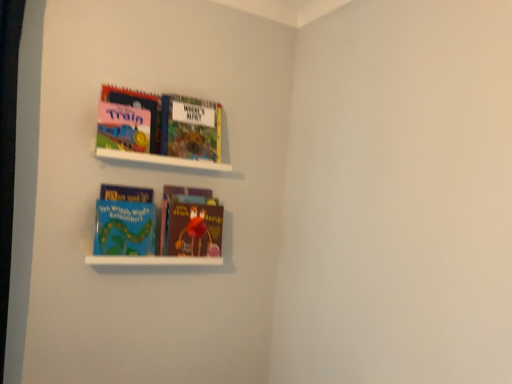
At what (x,y) coordinates should I click in order to perform the action: click on vacant area situated below hardcover book at upper center, the 2th book viewed from the top (from a real-world perspective). Please return your answer as a coordinate pair (x, y). This screenshot has height=384, width=512. Looking at the image, I should click on (190, 157).